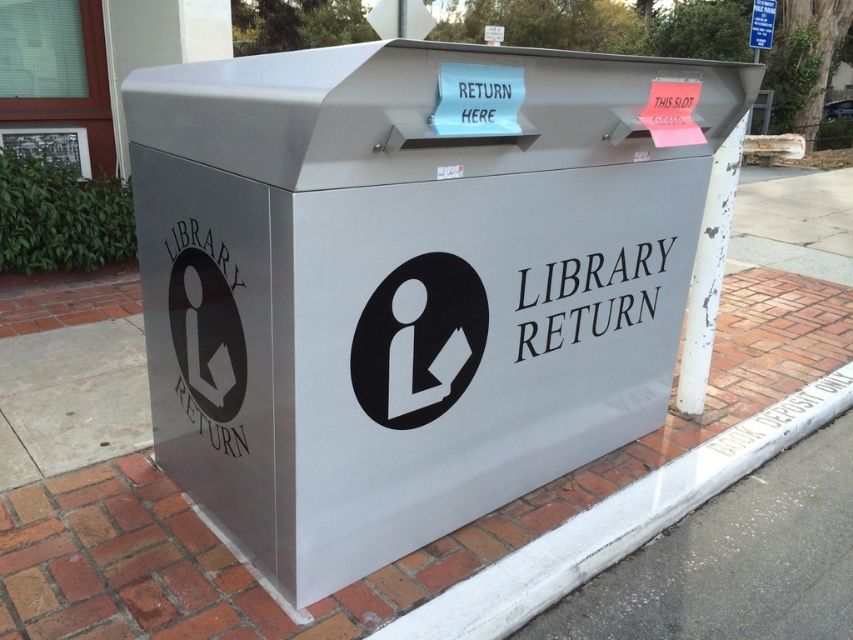
You are standing at the point marked as point (618, 522). What object is located at this position?

The white concrete curb at lower right is located at point (618, 522).

You are standing next to the metallic library return bin and want to place a book on the white concrete curb at lower right. Based on the coordinates provided, can you determine if the curb is positioned to the right or left of the bin?

The white concrete curb at lower right is located at point (x=618, y=522), which means it is positioned to the right of the bin.